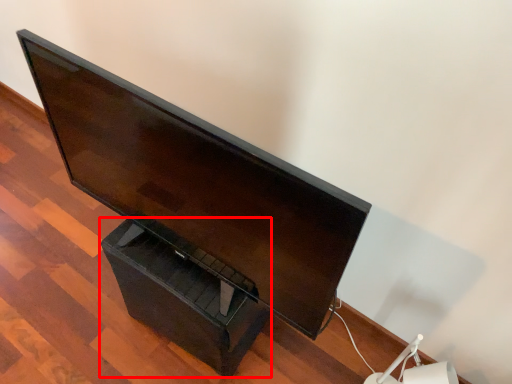
Question: From the image's perspective, where is drawer (annotated by the red box) located in relation to computer monitor in the image?

Choices:
 (A) below
 (B) above

Answer: (A)